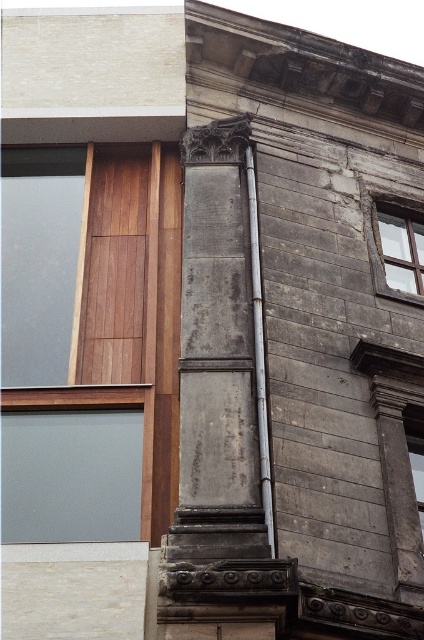
Question: Which point is farther to the camera?

Choices:
 (A) metallic pipe at center
 (B) matte gray stone window at upper right

Answer: (B)

Question: Can you confirm if matte gray stone window at upper right is positioned above metallic pipe at center?

Choices:
 (A) yes
 (B) no

Answer: (A)

Question: Is matte gray stone window at upper right behind metallic pipe at center?

Choices:
 (A) yes
 (B) no

Answer: (A)

Question: Does matte gray stone window at upper right have a greater width compared to metallic pipe at center?

Choices:
 (A) yes
 (B) no

Answer: (A)